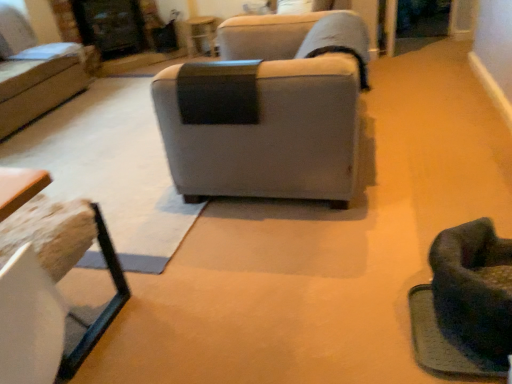
Question: Is matte gray couch at upper left, arranged as the 2th studio couch when ordered from the bottom, aimed at gray fabric couch at center, the 1th studio couch ordered from the bottom?

Choices:
 (A) yes
 (B) no

Answer: (A)

Question: Is matte gray couch at upper left, arranged as the 2th studio couch when ordered from the bottom, positioned with its back to gray fabric couch at center, the 1th studio couch ordered from the bottom?

Choices:
 (A) no
 (B) yes

Answer: (A)

Question: Does matte gray couch at upper left, arranged as the 2th studio couch when ordered from the bottom, have a lesser width compared to gray fabric couch at center, acting as the second studio couch starting from the left?

Choices:
 (A) no
 (B) yes

Answer: (B)

Question: Can gray fabric couch at center, the 1th studio couch ordered from the bottom, be found inside matte gray couch at upper left, the first studio couch when ordered from left to right?

Choices:
 (A) no
 (B) yes

Answer: (A)

Question: Can you confirm if matte gray couch at upper left, arranged as the 2th studio couch when ordered from the bottom, is shorter than gray fabric couch at center, arranged as the first studio couch when viewed from the front?

Choices:
 (A) no
 (B) yes

Answer: (B)

Question: From the image's perspective, is matte gray couch at upper left, which appears as the first studio couch when viewed from the back, beneath gray fabric couch at center, arranged as the first studio couch when viewed from the front?

Choices:
 (A) no
 (B) yes

Answer: (A)

Question: Is gray fabric couch at center, arranged as the first studio couch when viewed from the front, positioned beyond the bounds of soft green fabric swivel chair at lower right?

Choices:
 (A) yes
 (B) no

Answer: (A)

Question: Is gray fabric couch at center, the second studio couch in the top-to-bottom sequence, in front of soft green fabric swivel chair at lower right?

Choices:
 (A) no
 (B) yes

Answer: (A)

Question: Considering the relative positions of gray fabric couch at center, the second studio couch from the back, and soft green fabric swivel chair at lower right in the image provided, is gray fabric couch at center, the second studio couch from the back, behind soft green fabric swivel chair at lower right?

Choices:
 (A) yes
 (B) no

Answer: (A)

Question: Is gray fabric couch at center, the second studio couch in the top-to-bottom sequence, aimed at soft green fabric swivel chair at lower right?

Choices:
 (A) no
 (B) yes

Answer: (A)

Question: From the image's perspective, is gray fabric couch at center, the second studio couch in the top-to-bottom sequence, beneath soft green fabric swivel chair at lower right?

Choices:
 (A) yes
 (B) no

Answer: (B)

Question: From a real-world perspective, does gray fabric couch at center, the 1th studio couch ordered from the bottom, stand above soft green fabric swivel chair at lower right?

Choices:
 (A) no
 (B) yes

Answer: (B)

Question: From a real-world perspective, is wooden textured table at lower left, which ranks as the first table in front-to-back order, on top of soft green fabric swivel chair at lower right?

Choices:
 (A) no
 (B) yes

Answer: (B)